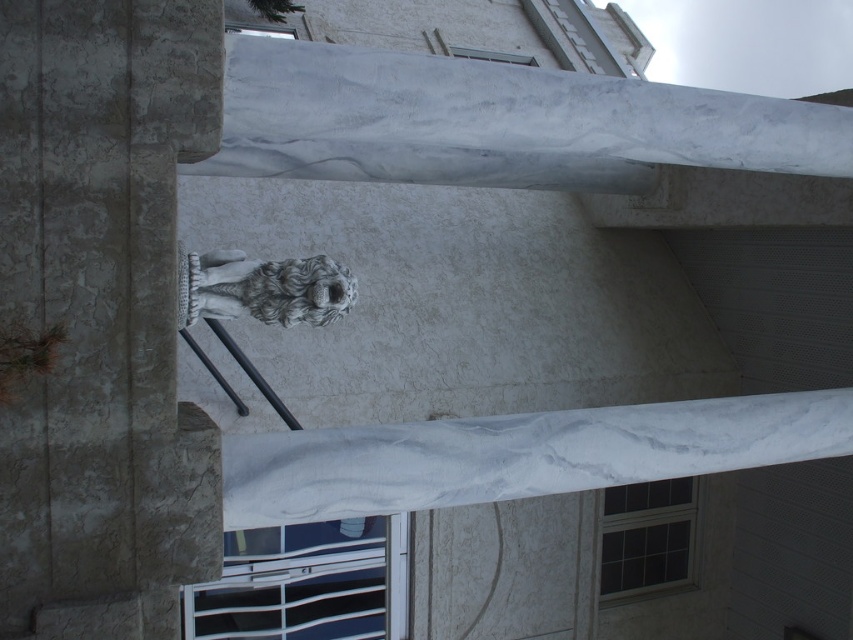
Question: Which object is farther from the camera taking this photo?

Choices:
 (A) gray stone owl at center
 (B) white marble column at center

Answer: (A)

Question: Does white marble column at center have a lesser width compared to gray stone owl at center?

Choices:
 (A) no
 (B) yes

Answer: (A)

Question: Is white marble column at center wider than gray stone owl at center?

Choices:
 (A) no
 (B) yes

Answer: (B)

Question: Considering the relative positions of white marble column at center and gray stone owl at center in the image provided, where is white marble column at center located with respect to gray stone owl at center?

Choices:
 (A) right
 (B) left

Answer: (B)

Question: Which object is closer to the camera taking this photo?

Choices:
 (A) white marble column at center
 (B) gray stone owl at center

Answer: (A)